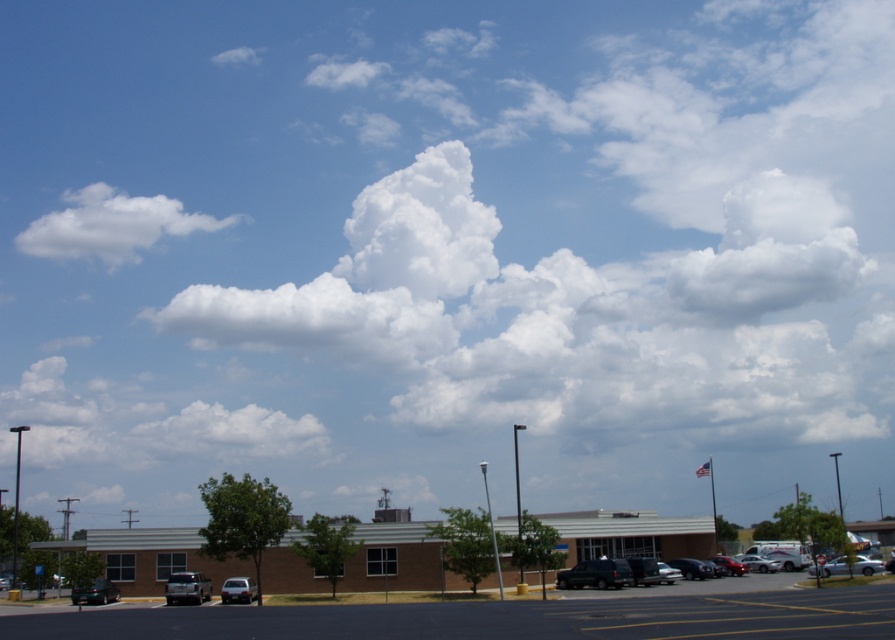
Question: Is matte silver sedan at lower center to the left of shiny silver sedan at center from the viewer's perspective?

Choices:
 (A) no
 (B) yes

Answer: (B)

Question: Which point appears farthest from the camera in this image?

Choices:
 (A) click(x=829, y=570)
 (B) click(x=64, y=612)
 (C) click(x=680, y=576)

Answer: (C)

Question: Can you confirm if matte black suv at center is positioned above metallic silver sedan at lower right?

Choices:
 (A) yes
 (B) no

Answer: (A)

Question: Which object is positioned farthest from the silver metallic sedan at lower right?

Choices:
 (A) black asphalt parking lot at lower center
 (B) metallic silver sedan at lower right
 (C) shiny silver sedan at center

Answer: (A)

Question: Considering the real-world distances, which object is farthest from the white fluffy cloud at upper center?

Choices:
 (A) shiny silver sedan at center
 (B) matte silver sedan at lower center
 (C) white fluffy cloud at upper left

Answer: (B)

Question: In this image, where is white fluffy cloud at upper left located relative to matte black suv at center?

Choices:
 (A) left
 (B) right

Answer: (A)